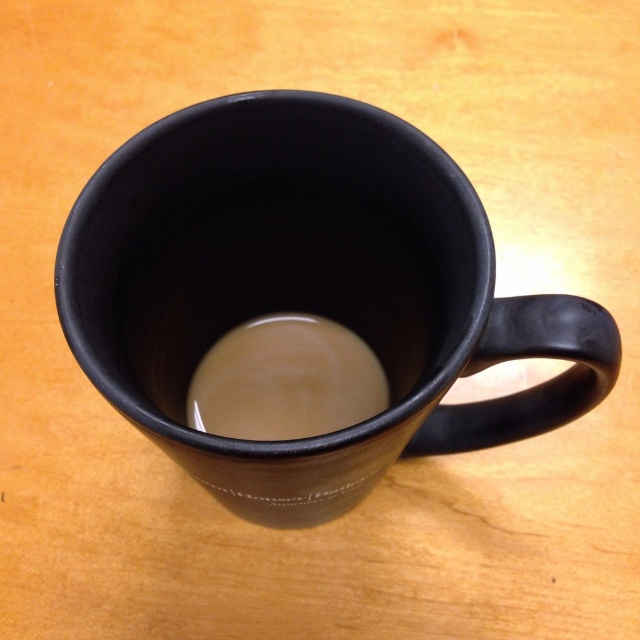
In the scene shown: You are a barista preparing a latte and need to pour steamed milk into the matte black mug at center. Based on the image, where should you pour the milk relative to the creamy matte coffee at center?

The matte black mug at center is located above the creamy matte coffee at center, so you should pour the milk below the creamy matte coffee at center into the matte black mug at center.

You are a barista trying to place a matte black mug at center on a tray. The tray has a small hole at point (x=308, y=291). Will the mug fall through the hole?

The point (x=308, y=291) indicates the location of the matte black mug at center, so placing the mug directly over the hole would cause it to fall through.